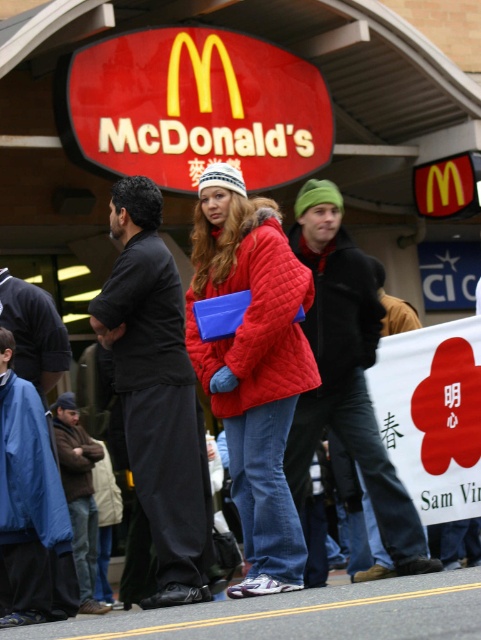
You are standing at the entrance of the McDonalds and see the black matte shirt at center. If you want to hand them a flyer, can you reach them without moving closer than 25 feet?

The black matte shirt at center and viewer are 26.66 feet apart from each other, so you cannot reach them without moving closer than 25 feet.

You are a fashion designer observing people outside a McDonalds. You see the quilted red coat at center and the black matte shirt at center. Which clothing item appears smaller in size?

The quilted red coat at center has a smaller size compared to the black matte shirt at center, so the quilted red coat at center appears smaller in size.

You are a photographer trying to capture a group photo of the people waiting outside McDonalds. You notice two individuals wearing jackets with different colors and materials. The quilted red coat at center and the brown woolen jacket at lower left. Which jacket wearer is taller?

The quilted red coat at center is much taller than the brown woolen jacket at lower left, so the person wearing the quilted red coat at center is taller.